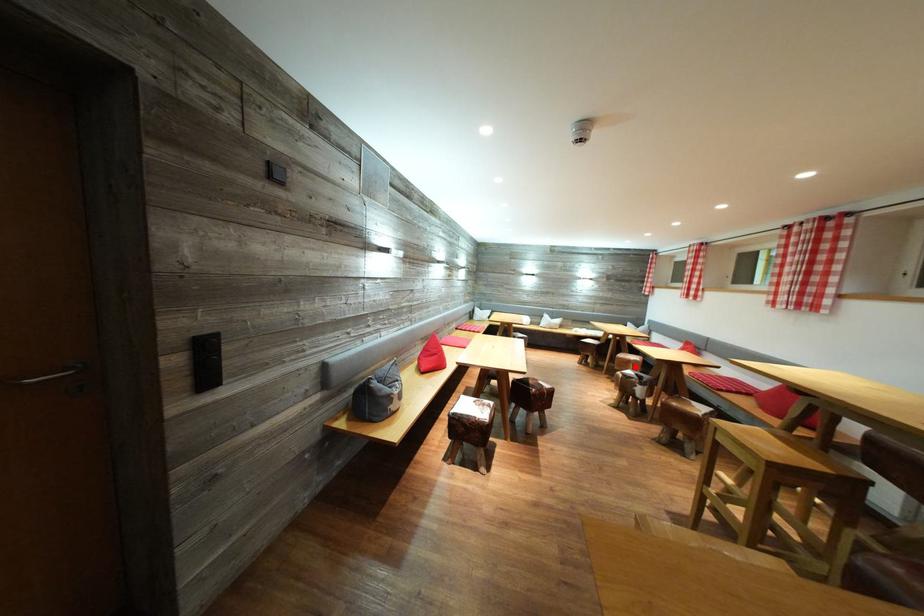
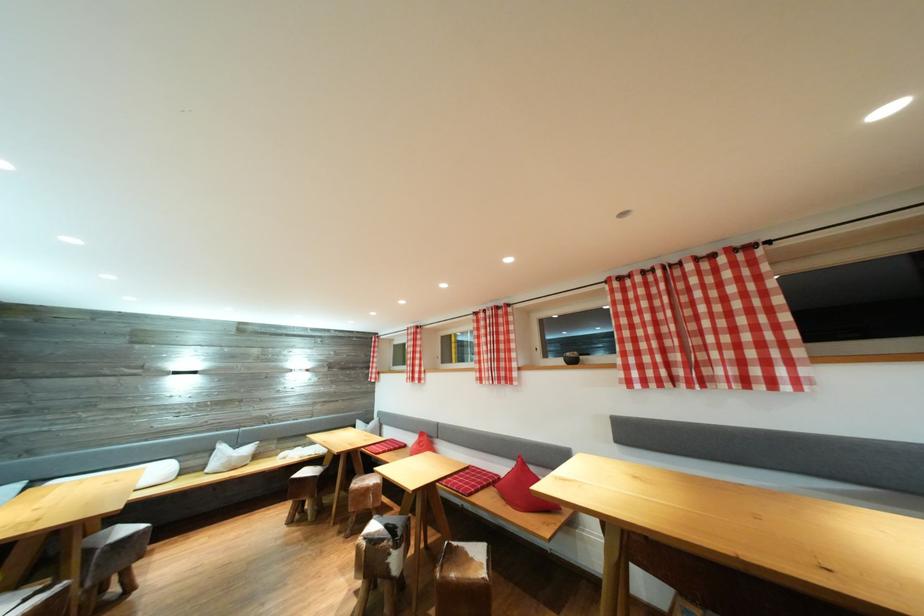
The point at the highlighted location is marked in the first image. Where is the corresponding point in the second image?

(373, 496)